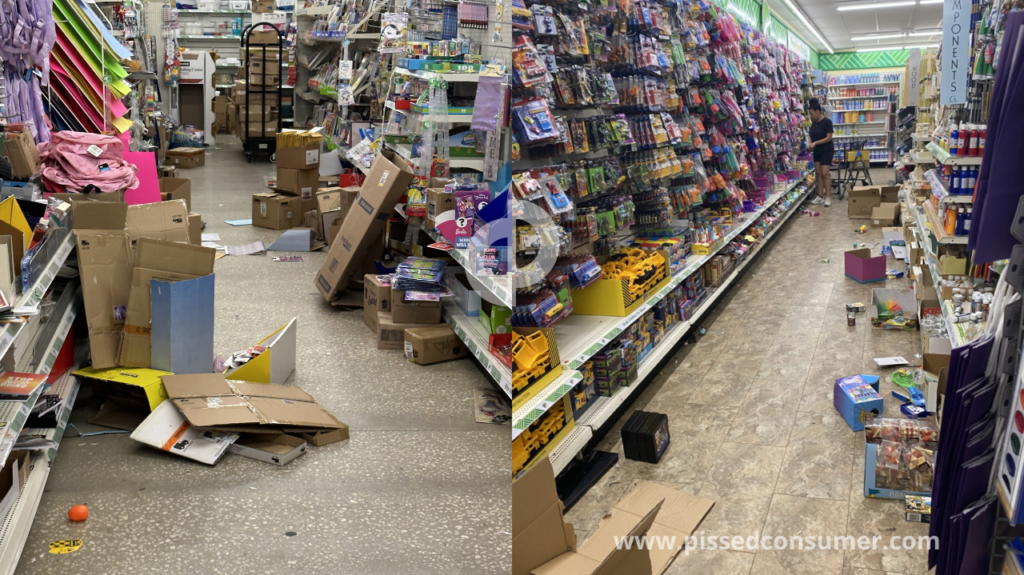
Find the location of a particular element. The width and height of the screenshot is (1024, 575). colored poster board is located at coordinates (96, 21), (94, 38), (87, 45), (86, 60), (85, 75), (85, 84), (82, 104), (77, 118), (57, 121).